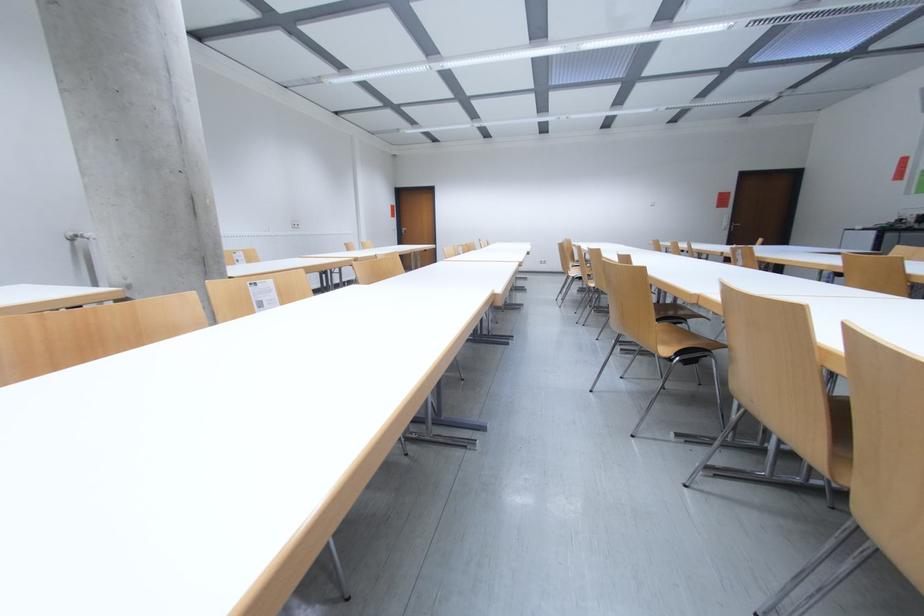
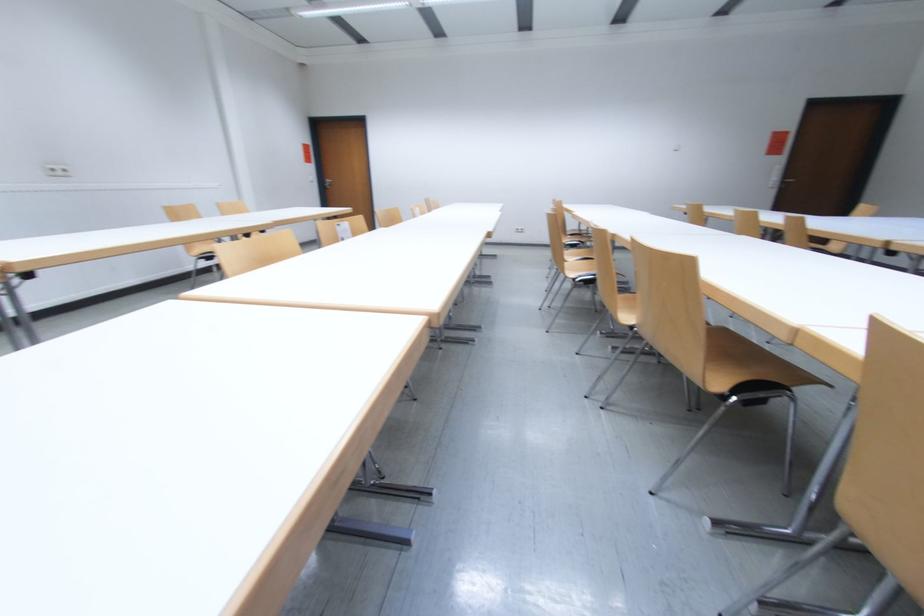
Question: In a continuous first-person perspective shot, in which direction is the camera moving?

Choices:
 (A) Left
 (B) Right
 (C) Forward
 (D) Backward

Answer: (C)